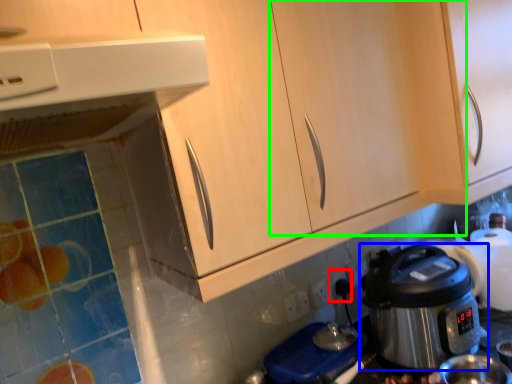
Question: Based on their relative distances, which object is farther from electric outlet (highlighted by a red box)? Choose from rice cooker (highlighted by a blue box) and cabinetry (highlighted by a green box).

Choices:
 (A) rice cooker
 (B) cabinetry

Answer: (B)